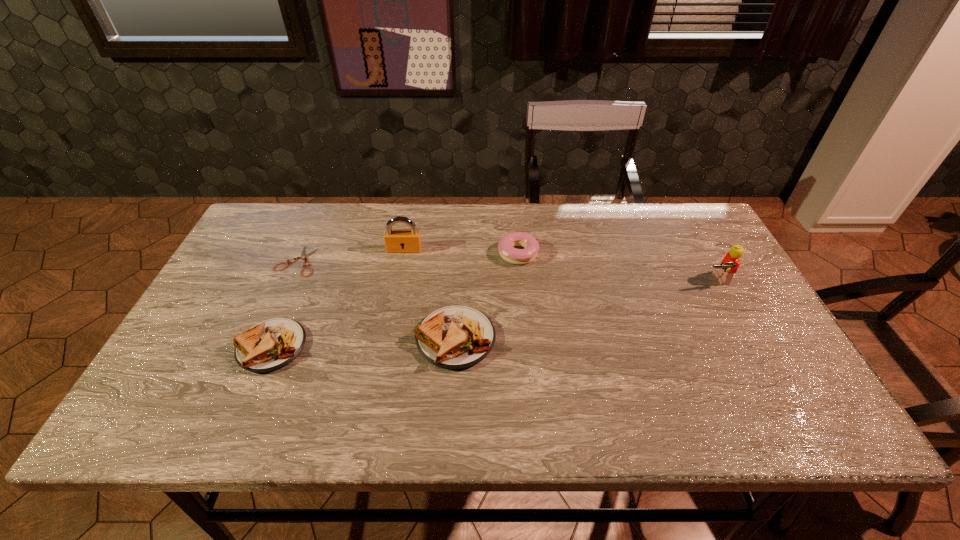
Locate an element on the screen. The width and height of the screenshot is (960, 540). vacant space that satisfies the following two spatial constraints: 1. on the front side of the right sandwich; 2. on the right side of the shears is located at coordinates (263, 339).

Find the location of `vacant area in the image that satisfies the following two spatial constraints: 1. to unlock the padlock from the front; 2. on the right side of the taller sandwich`. vacant area in the image that satisfies the following two spatial constraints: 1. to unlock the padlock from the front; 2. on the right side of the taller sandwich is located at coordinates (388, 339).

You are a GUI agent. You are given a task and a screenshot of the screen. Output one action in this format:
    pyautogui.click(x=<x>, y=<y>)
    Task: Click on the vacant space that satisfies the following two spatial constraints: 1. to unlock the fourth object from right to left from the front; 2. on the right side of the right sandwich
    Image resolution: width=960 pixels, height=540 pixels.
    Given the screenshot: What is the action you would take?
    pyautogui.click(x=388, y=339)